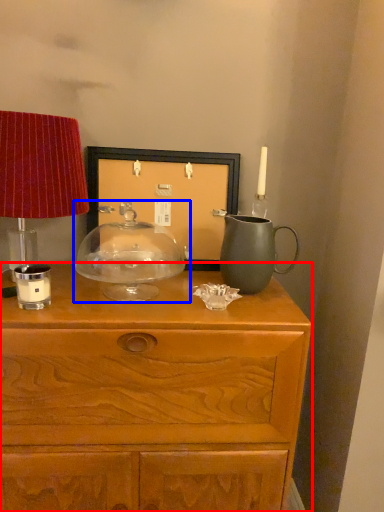
Question: Which object is closer to the camera taking this photo, chest of drawers (highlighted by a red box) or candle holder (highlighted by a blue box)?

Choices:
 (A) chest of drawers
 (B) candle holder

Answer: (A)